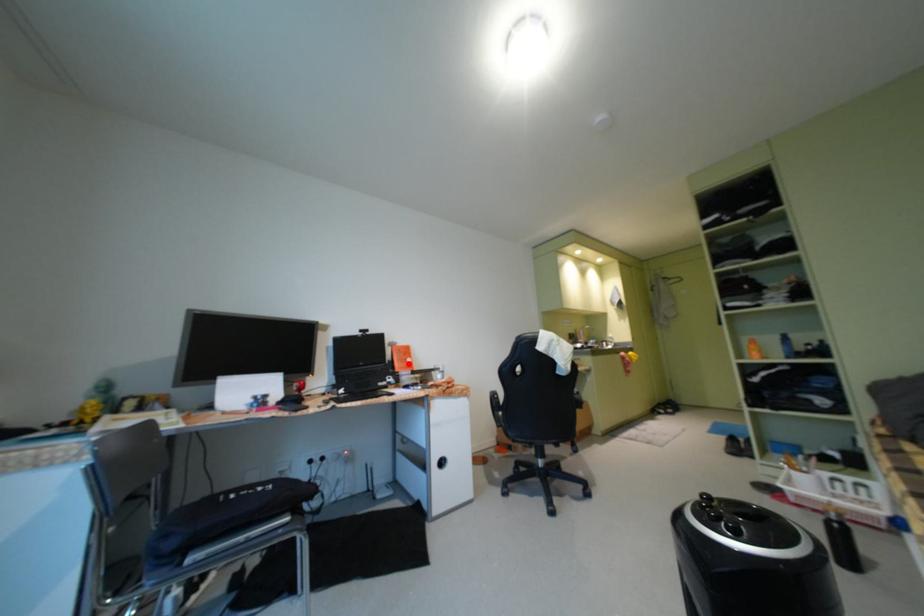
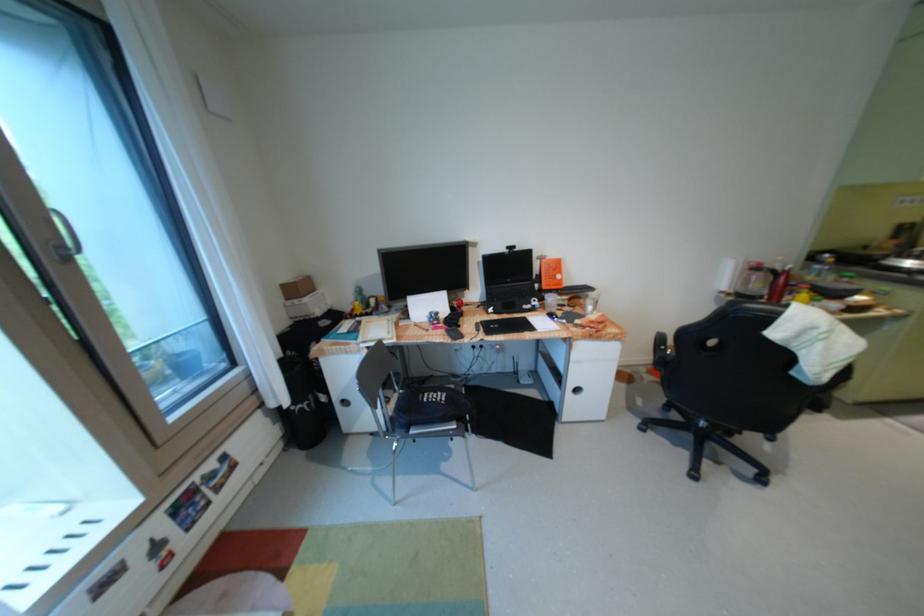
The point at the highlighted location is marked in the first image. Where is the corresponding point in the second image?

(555, 280)